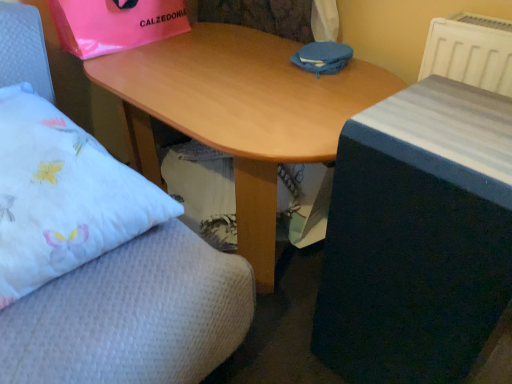
Question: Is pink plastic bag at upper left at the right side of white fabric pillow at left?

Choices:
 (A) no
 (B) yes

Answer: (B)

Question: Is white fabric pillow at left inside pink plastic bag at upper left?

Choices:
 (A) no
 (B) yes

Answer: (A)

Question: Considering the relative sizes of pink plastic bag at upper left and white fabric pillow at left in the image provided, is pink plastic bag at upper left shorter than white fabric pillow at left?

Choices:
 (A) no
 (B) yes

Answer: (B)

Question: Is pink plastic bag at upper left positioned beyond the bounds of white fabric pillow at left?

Choices:
 (A) no
 (B) yes

Answer: (B)

Question: Is pink plastic bag at upper left oriented towards white fabric pillow at left?

Choices:
 (A) yes
 (B) no

Answer: (B)

Question: Is pink plastic bag at upper left placed right next to white fabric pillow at left?

Choices:
 (A) yes
 (B) no

Answer: (B)

Question: Is pink plastic bag at upper left with wooden desk at center?

Choices:
 (A) yes
 (B) no

Answer: (B)

Question: From a real-world perspective, is pink plastic bag at upper left under wooden desk at center?

Choices:
 (A) yes
 (B) no

Answer: (B)

Question: Is pink plastic bag at upper left not close to wooden desk at center?

Choices:
 (A) no
 (B) yes

Answer: (A)

Question: Does pink plastic bag at upper left have a smaller size compared to wooden desk at center?

Choices:
 (A) no
 (B) yes

Answer: (B)

Question: Considering the relative sizes of pink plastic bag at upper left and wooden desk at center in the image provided, is pink plastic bag at upper left shorter than wooden desk at center?

Choices:
 (A) no
 (B) yes

Answer: (B)

Question: From the image's perspective, is pink plastic bag at upper left beneath wooden desk at center?

Choices:
 (A) no
 (B) yes

Answer: (A)

Question: From a real-world perspective, is white plastic radiator at upper right physically above wooden table at center?

Choices:
 (A) yes
 (B) no

Answer: (A)